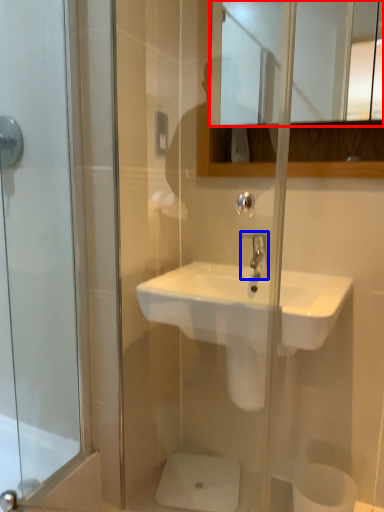
Question: Among these objects, which one is farthest to the camera, mirror (highlighted by a red box) or tap (highlighted by a blue box)?

Choices:
 (A) mirror
 (B) tap

Answer: (B)